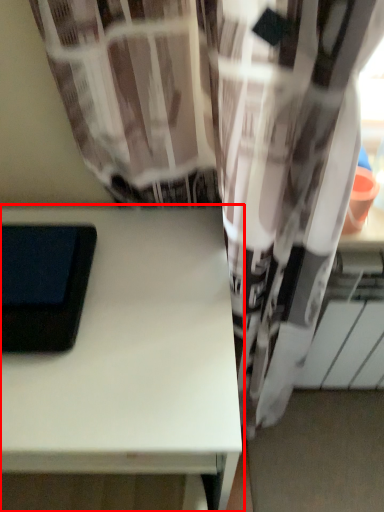
Question: From the image's perspective, considering the relative positions of table (annotated by the red box) and ipad in the image provided, where is table (annotated by the red box) located with respect to the staircase?

Choices:
 (A) below
 (B) above

Answer: (A)